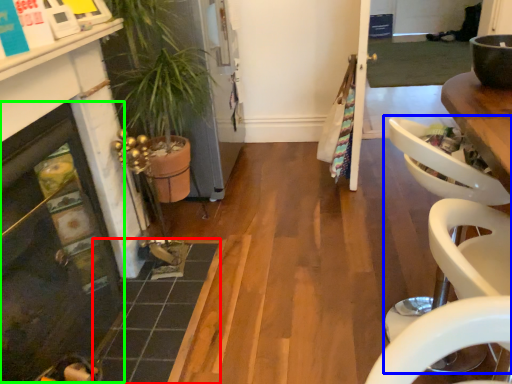
Question: Which object is positioned closest to tile (highlighted by a red box)? Select from armchair (highlighted by a blue box) and fireplace (highlighted by a green box).

Choices:
 (A) armchair
 (B) fireplace

Answer: (B)